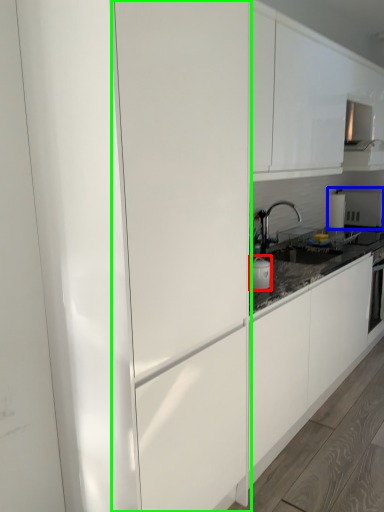
Question: Based on their relative distances, which object is nearer to appliance (highlighted by a red box)? Choose from appliance (highlighted by a blue box) and glass door (highlighted by a green box).

Choices:
 (A) appliance
 (B) glass door

Answer: (B)